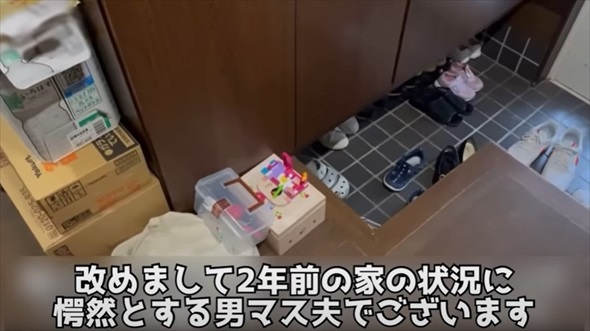
The image size is (590, 331). Find the location of `brown handle`. brown handle is located at coordinates pos(258,205).